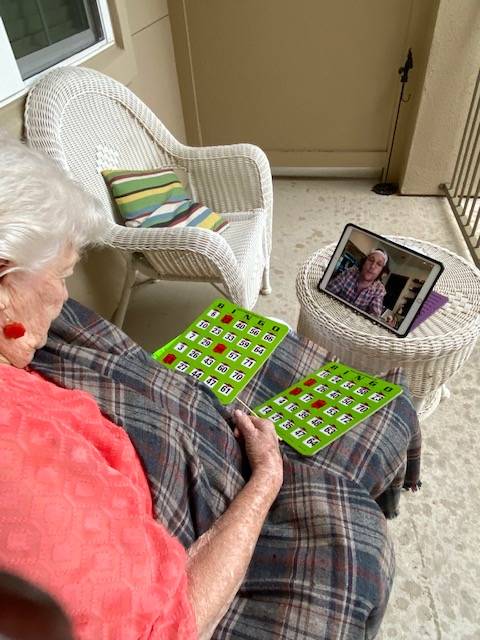
Find the location of `white wicker chair`. white wicker chair is located at coordinates (82, 122).